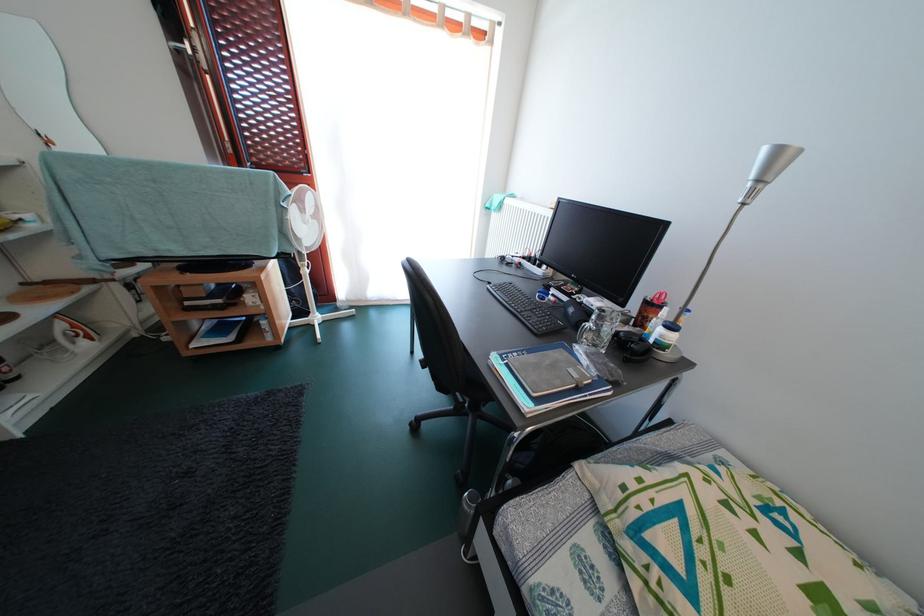
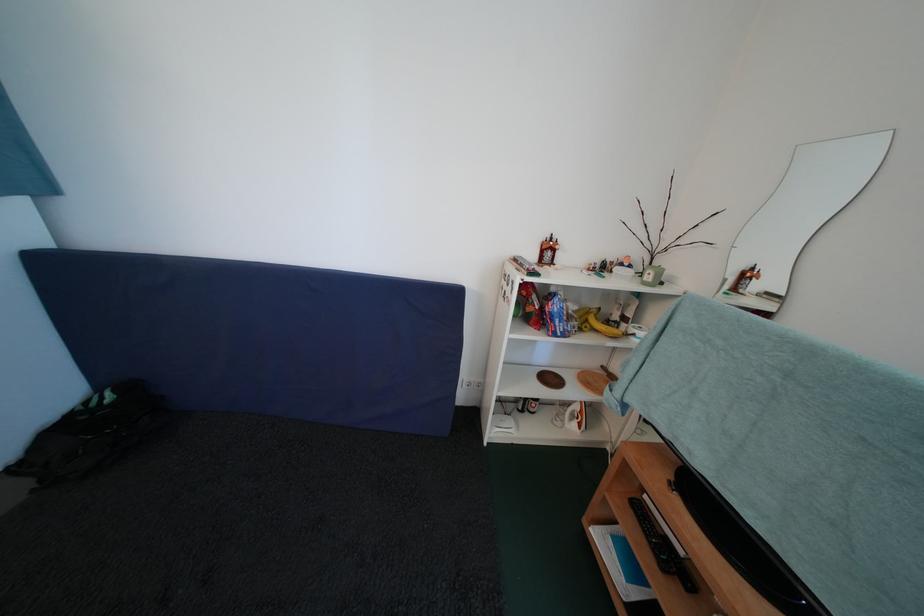
The point at (x=68, y=331) is marked in the first image. Where is the corresponding point in the second image?

(584, 411)